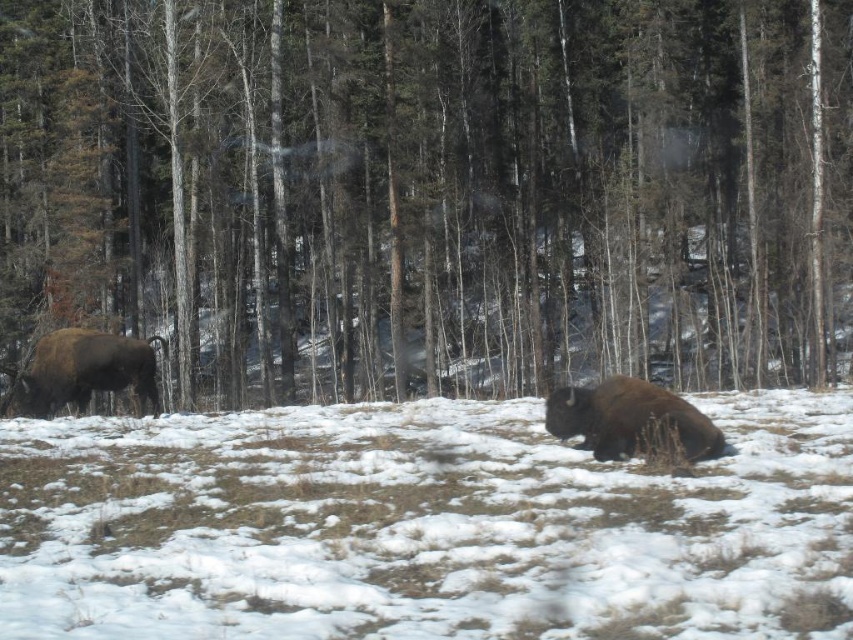
Does brown wood tree at left have a larger size compared to white fluffy snow at center?

Indeed, brown wood tree at left has a larger size compared to white fluffy snow at center.

Is brown wood tree at left in front of white fluffy snow at center?

No, it is not.

Is point (277, 396) positioned behind point (181, 611)?

Yes, point (277, 396) is behind point (181, 611).

The height and width of the screenshot is (640, 853). What are the coordinates of `brown wood tree at left` in the screenshot? It's located at (430, 189).

Does brown furry bison at lower center appear under brown furry bison at left?

Indeed, brown furry bison at lower center is positioned under brown furry bison at left.

Between brown furry bison at lower center and brown furry bison at left, which one is positioned higher?

Positioned higher is brown furry bison at left.

Between point (595, 406) and point (20, 387), which one is positioned behind?

Point (20, 387)

You are a GUI agent. You are given a task and a screenshot of the screen. Output one action in this format:
    pyautogui.click(x=<x>, y=<y>)
    Task: Click on the brown furry bison at lower center
    The image size is (853, 640).
    Given the screenshot: What is the action you would take?
    pyautogui.click(x=631, y=420)

Who is lower down, white fluffy snow at center or brown furry bison at left?

Positioned lower is white fluffy snow at center.

Measure the distance between point (421,614) and camera.

They are 21.46 feet apart.

Identify the location of white fluffy snow at center. (422, 525).